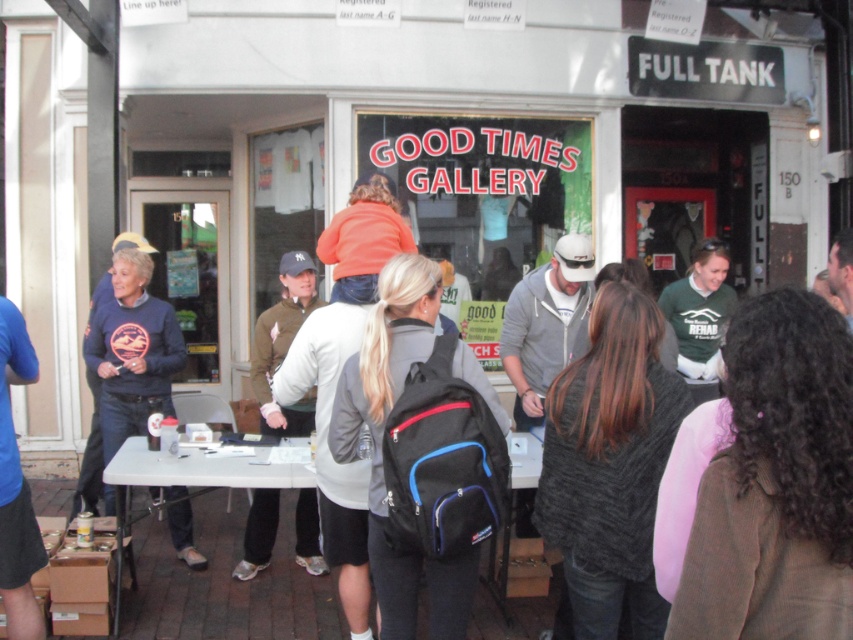
Consider the image. You are a customer looking at two sweaters displayed on a table outside the GOOD TIMES GALLERY. The sweaters are labeled as dark gray sweater at center and navy blue sweater at left. Which sweater is located to the left of the other?

The navy blue sweater at left is located to the left of the dark gray sweater at center.

You are a fashion designer observing the crowd outside GOOD TIMES GALLERY. You notice two items of clothing on the table. Which item has a taller silhouette between the navy blue sweater at left and the khaki cotton jacket at center?

The navy blue sweater at left has a taller silhouette than the khaki cotton jacket at center.

You are a visitor at the GOOD TIMES GALLERY and see two people wearing the green cotton shirt at right and the navy blue sweater at left. Which one is standing more to your right side?

The green cotton shirt at right is more to the right side.